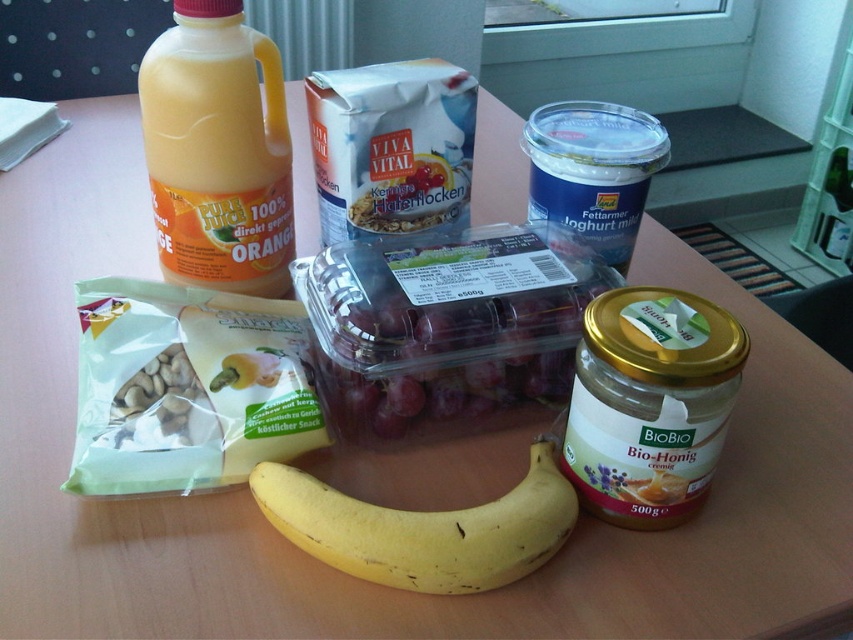
Who is lower down, matte plastic bottle of orange juice at upper left or white matte nuts at center-left?

white matte nuts at center-left is below.

Is point (180, 250) closer to camera compared to point (120, 442)?

No, (180, 250) is further to viewer.

Does point (154, 97) lie in front of point (135, 387)?

No, it is behind (135, 387).

Find the location of a particular element. The height and width of the screenshot is (640, 853). matte plastic bottle of orange juice at upper left is located at coordinates (218, 150).

From the picture: Does yellow matte banana at center have a greater width compared to white matte nuts at center-left?

Indeed, yellow matte banana at center has a greater width compared to white matte nuts at center-left.

Between yellow matte banana at center and white matte nuts at center-left, which one has less height?

white matte nuts at center-left is shorter.

Which is in front, point (252, 492) or point (201, 387)?

Point (252, 492) is in front.

The height and width of the screenshot is (640, 853). Find the location of `yellow matte banana at center`. yellow matte banana at center is located at coordinates (424, 529).

Which is below, purple translucent grapes at center or matte plastic bottle of orange juice at upper left?

purple translucent grapes at center

Which of these two, purple translucent grapes at center or matte plastic bottle of orange juice at upper left, stands taller?

matte plastic bottle of orange juice at upper left is taller.

Does point (497, 396) come behind point (186, 93)?

No, it is in front of (186, 93).

Find the location of a particular element. This screenshot has height=640, width=853. purple translucent grapes at center is located at coordinates point(448,323).